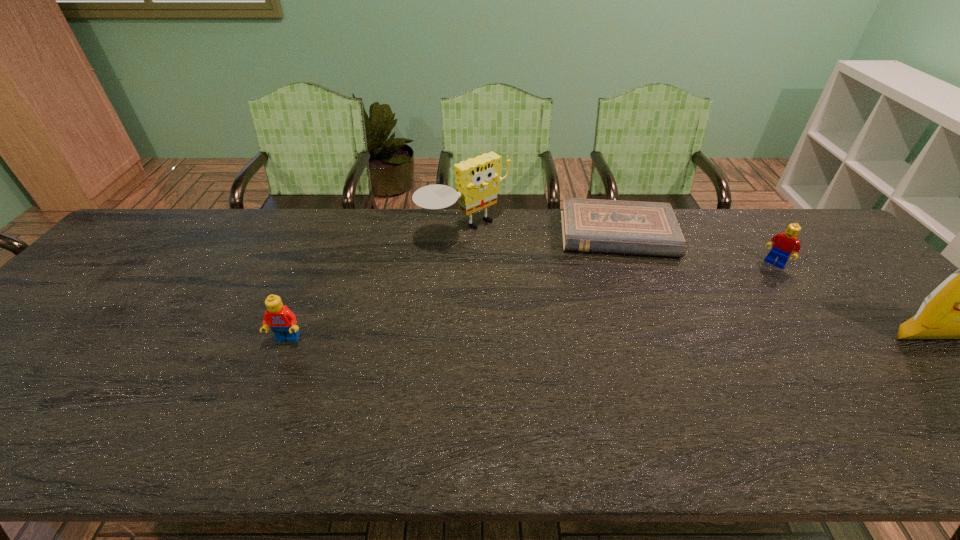
Find the location of a particular element. Image resolution: width=960 pixels, height=540 pixels. vacant space at the far edge of the desktop is located at coordinates (240, 234).

The height and width of the screenshot is (540, 960). In the image, there is a desktop. In order to click on blank space at the left edge in this screenshot , I will do `click(110, 259)`.

Find the location of `vacant space at the far left corner of the desktop`. vacant space at the far left corner of the desktop is located at coordinates (132, 235).

This screenshot has height=540, width=960. I want to click on vacant space at the far right corner, so click(x=775, y=231).

You are a GUI agent. You are given a task and a screenshot of the screen. Output one action in this format:
    pyautogui.click(x=<x>, y=<y>)
    Task: Click on the free space between the left Lego and the right Lego
    
    Given the screenshot: What is the action you would take?
    pyautogui.click(x=531, y=301)

Locate an element on the screen. This screenshot has height=540, width=960. free spot between the Bible and the left Lego is located at coordinates (452, 287).

At what (x,y) coordinates should I click in order to perform the action: click on free space that is in between the shortest object and the fourth shortest object. Please return your answer as a coordinate pair (x, y). Looking at the image, I should click on (540, 232).

The width and height of the screenshot is (960, 540). I want to click on vacant space that's between the third object from right to left and the right Lego, so click(x=696, y=249).

Choose which object is the second nearest neighbor to the third object from right to left. Please provide its 2D coordinates. Your answer should be formatted as a tuple, i.e. [(x, y)], where the tuple contains the x and y coordinates of a point satisfying the conditions above.

[(784, 244)]

Find the location of a particular element. This screenshot has width=960, height=540. the second closest object to the tallest object is located at coordinates (588, 225).